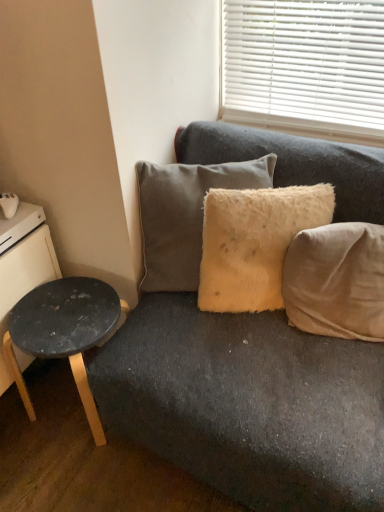
Locate an element on the screen. Image resolution: width=384 pixels, height=512 pixels. vacant space situated above matte black stool at lower left (from a real-world perspective) is located at coordinates (59, 310).